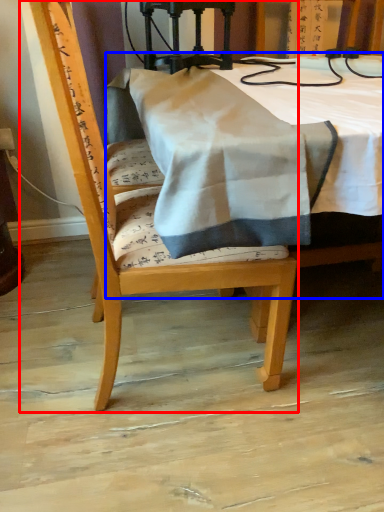
Question: Which point is closer to the camera, chair (highlighted by a red box) or table (highlighted by a blue box)?

Choices:
 (A) chair
 (B) table

Answer: (B)